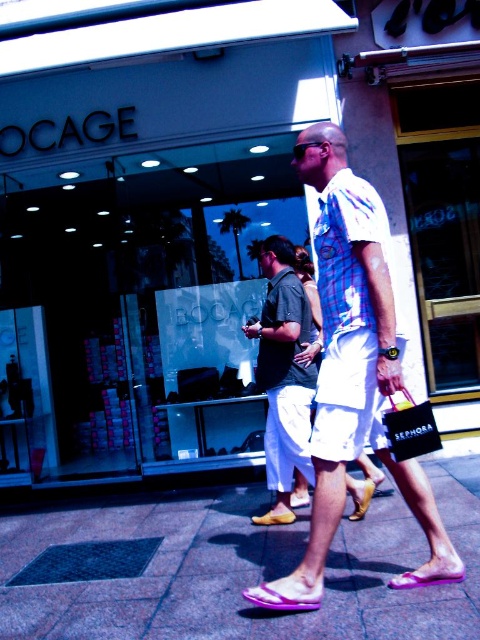
You are a customer standing in front of the BOCAGE store and see the purple fabric sandal at lower center and the leather tan sandal at lower center displayed in the window. If you want to place both sandals side by side on a shelf that is 40 inches long, will they fit without overlapping?

The purple fabric sandal at lower center is 36.29 inches from the leather tan sandal at lower center, so placing them side by side on a 40 inch shelf would require a total space of approximately 36.29 inches. Since 36.29 inches is less than 40 inches, they would fit without overlapping.

You are a customer looking at the sandals displayed in the BOCAGE store window. You notice the purple fabric sandal at lower center and the leather tan sandal at lower center. Which sandal is located to the left when viewed from the street?

The purple fabric sandal at lower center is positioned on the left side of the leather tan sandal at lower center, so when viewed from the street, the purple fabric sandal at lower center is to the left.

You are a delivery person standing at the entrance of BOCAGE store. You need to place a package that is 4 feet long on the ground between the matte glass storefront at center and the purple rubber sandals at center. Is there enough space?

The distance between the matte glass storefront at center and the purple rubber sandals at center is 5.34 feet. Since the package is 4 feet long, there is sufficient space to place it between them.